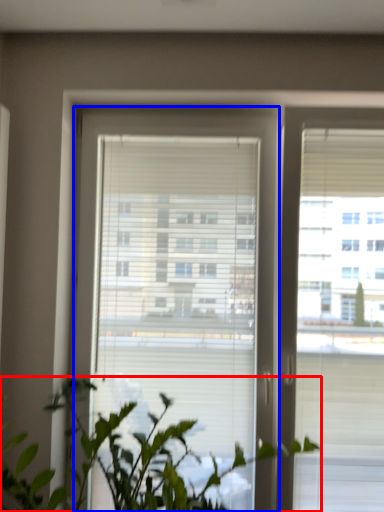
Question: Which point is further to the camera, houseplant (highlighted by a red box) or window (highlighted by a blue box)?

Choices:
 (A) houseplant
 (B) window

Answer: (B)